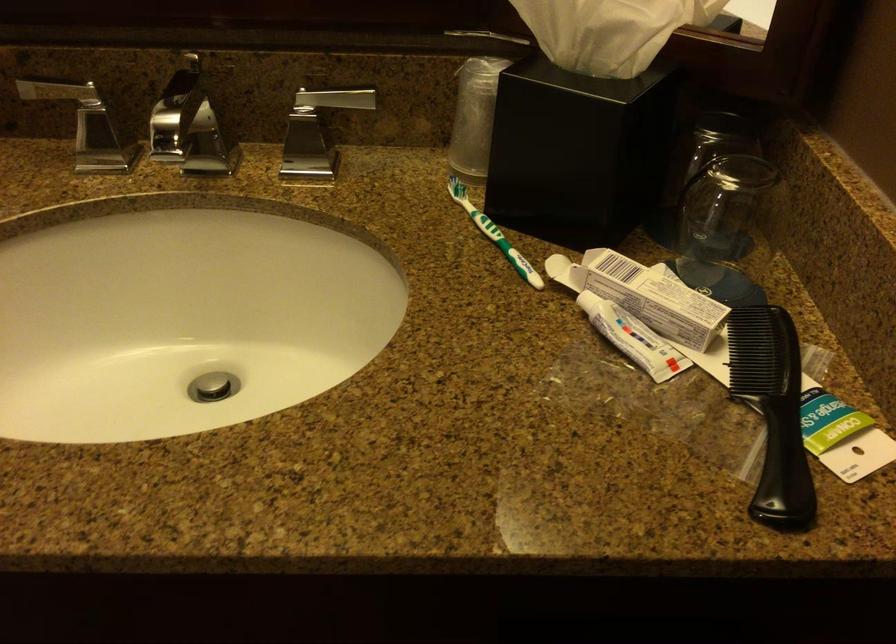
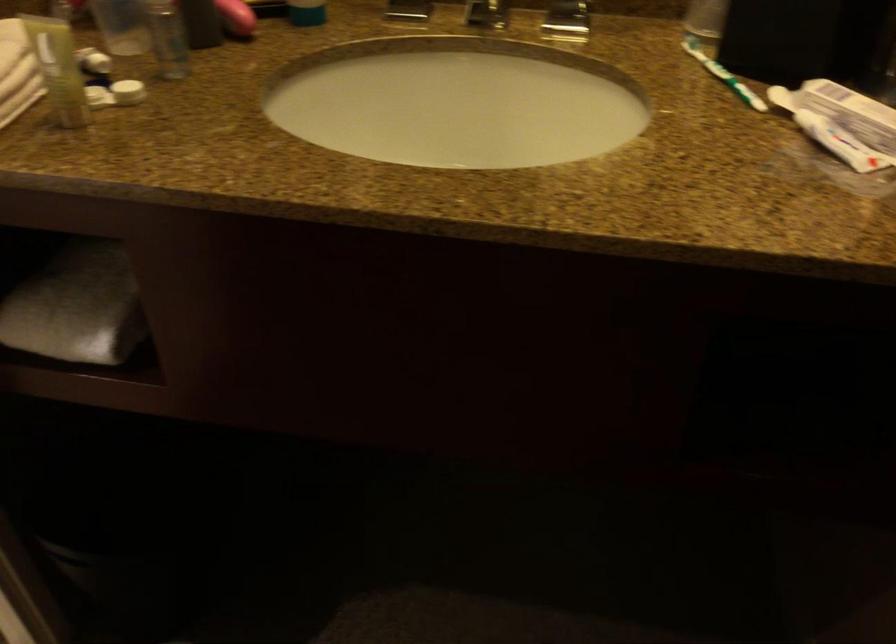
Question: I am providing you with two images of the same scene from different viewpoints. Please identify which objects are invisible in image2.

Choices:
 (A) toothpaste tube
 (B) folded white towel
 (C) green toothbrush
 (D) none of these

Answer: (D)